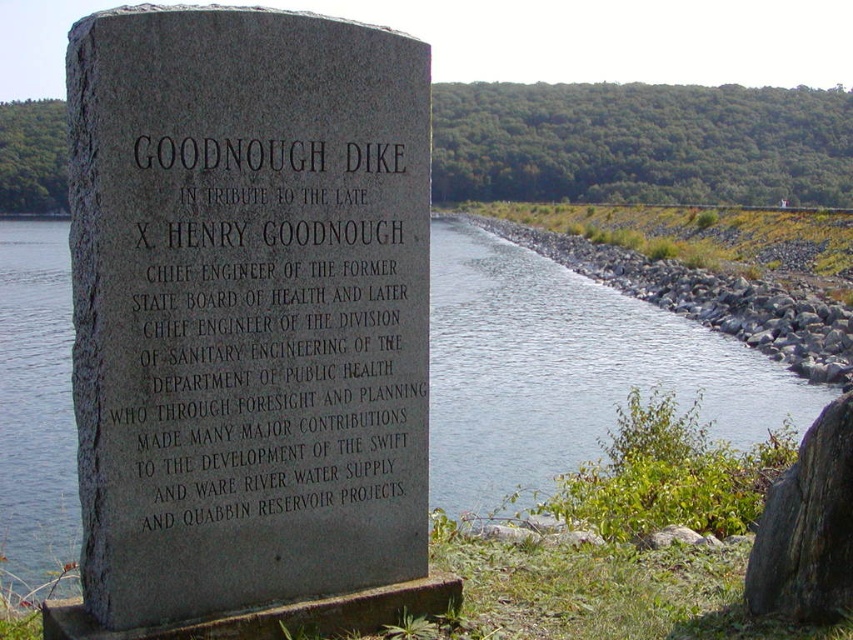
You are a visitor standing at the edge of the water and want to take a photo of both the gray stone monument at center and the clear water at center. Which object should you focus on first if you want both to be in sharp focus?

You should focus on the gray stone monument at center first because it is thinner than the clear water at center, so focusing on the thinner object increases the chances of both being in sharp focus.

You are standing near the monument and want to cross to the other side of the clear water at center. There is a gray rough rock at right nearby. Which direction should you head to reach the rock first before crossing?

You should head towards the right side since the clear water at center is positioned on the left side of the gray rough rock at right, meaning the rock is to the right of the water. Head right to reach the rock first before crossing.

What can be inferred about the size relationship between the gray stone monument at center and the gray rough rock at right?

The gray stone monument at center has a smaller size compared to the gray rough rock at right.